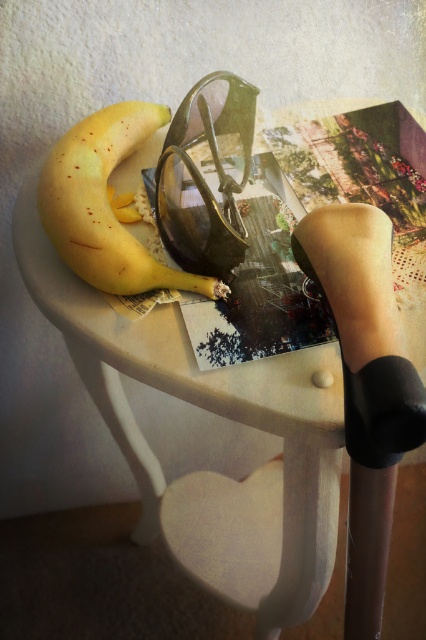
Based on the photo, you are trying to place both the yellow matte banana at left and the shiny black goggles at center into a rectangular container that can only hold items up to the size of the wider object. Which object determines the minimum required width of the container?

The yellow matte banana at left determines the minimum required width of the container because its width is larger than that of the shiny black goggles at center.

You are organizing items on a table and need to place the yellow matte banana at left and the shiny black goggles at center. If you want to move the banana closer to the goggles, which direction should you move it?

Since the yellow matte banana at left is currently further to the viewer than the shiny black goggles at center, you should move it forward towards the goggles to bring them closer.

You are organizing a picnic basket and need to decide whether the yellow matte banana at left can fit into a small container designed for the shiny black goggles at center. Based on their sizes, will the banana fit?

The yellow matte banana at left is larger in size than the shiny black goggles at center, so it may not fit into the container designed for the goggles.